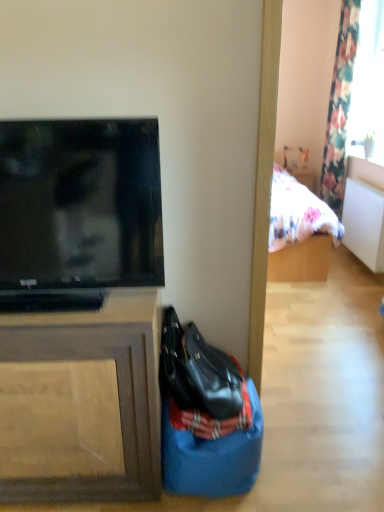
You are a GUI agent. You are given a task and a screenshot of the screen. Output one action in this format:
    pyautogui.click(x=<x>, y=<y>)
    Task: Click on the vacant location below matte black television at left (from a real-world perspective)
    This screenshot has height=512, width=384.
    Given the screenshot: What is the action you would take?
    pyautogui.click(x=81, y=303)